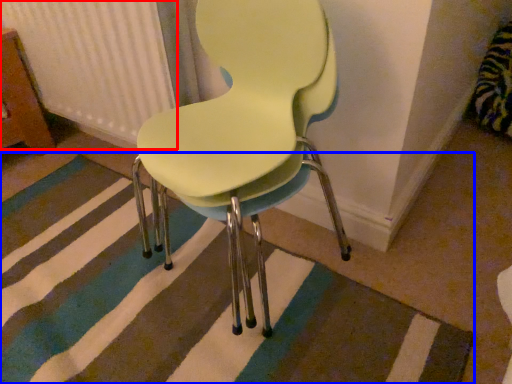
Question: Which of the following is the closest to the observer, radiator (highlighted by a red box) or doormat (highlighted by a blue box)?

Choices:
 (A) radiator
 (B) doormat

Answer: (B)